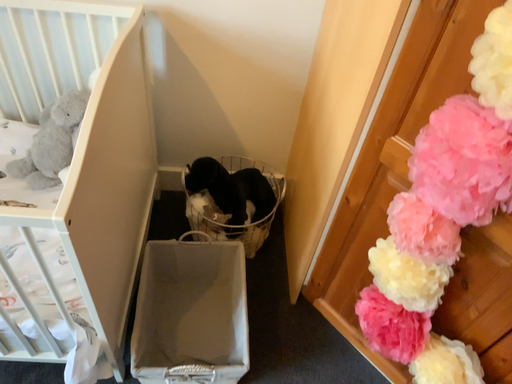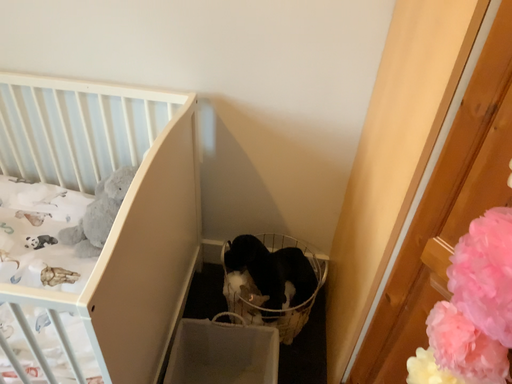
Question: How did the camera likely rotate when shooting the video?

Choices:
 (A) rotated right
 (B) rotated left

Answer: (B)